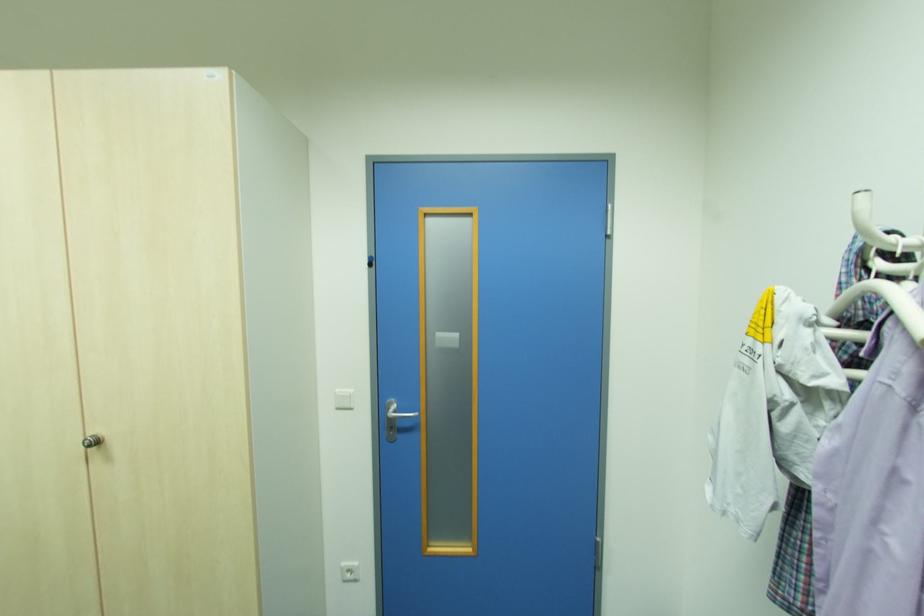
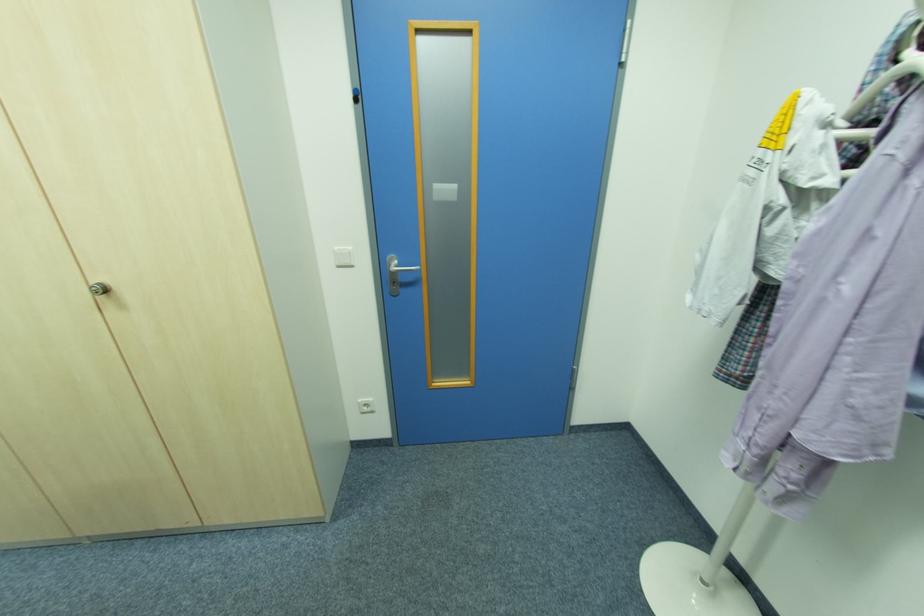
Question: How did the camera likely rotate?

Choices:
 (A) Left
 (B) Right
 (C) Up
 (D) Down

Answer: (D)